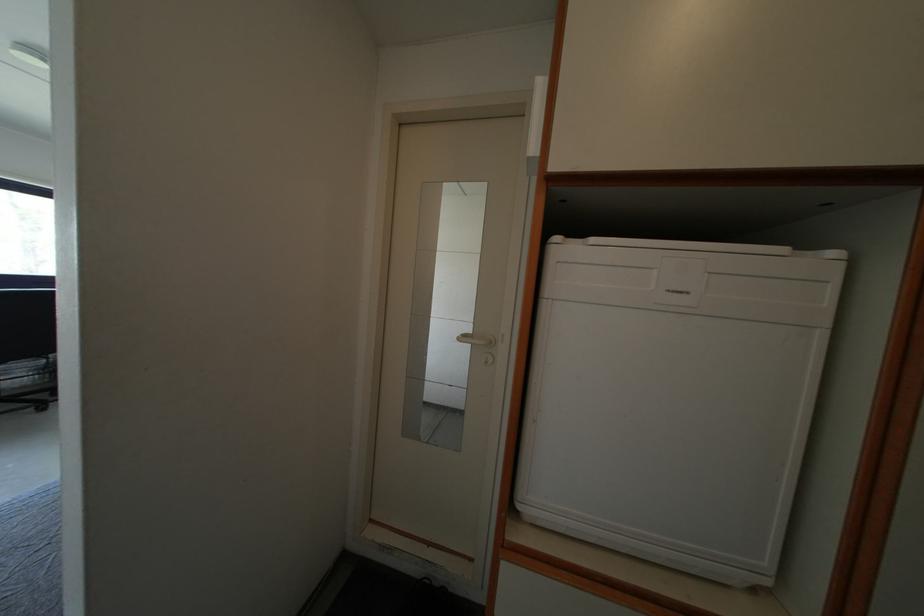
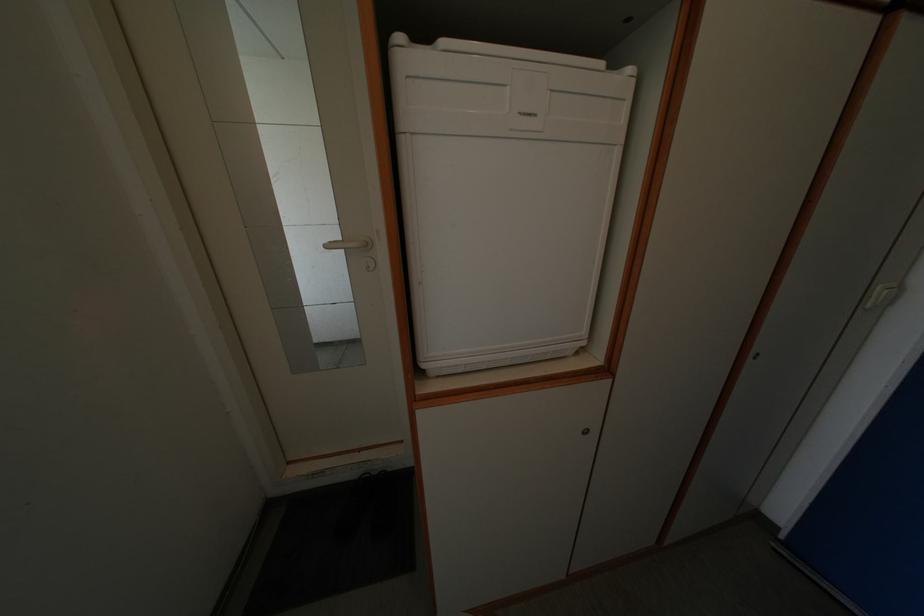
The point at (695, 298) is marked in the first image. Where is the corresponding point in the second image?

(542, 120)